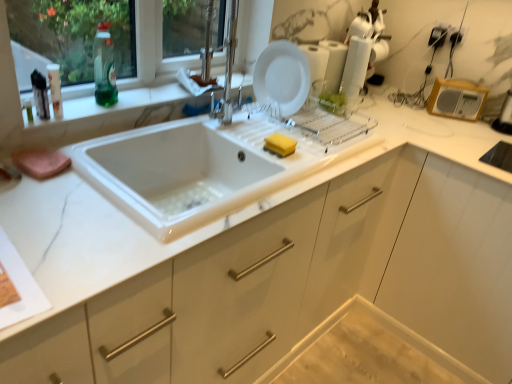
I want to click on translucent plastic bottle at upper left, arranged as the second bottle when viewed from the right, so click(x=55, y=89).

In order to face white glossy plate at upper center, which is the second appliance from right to left, should I rotate leftwards or rightwards?

To face it directly, rotate right by 8.018 degrees.

What do you see at coordinates (104, 67) in the screenshot? The height and width of the screenshot is (384, 512). I see `green translucent bottle at upper left, the second bottle from the front` at bounding box center [104, 67].

This screenshot has height=384, width=512. Identify the location of wooden radio at upper right, placed as the 2th appliance when sorted from left to right. (456, 99).

What is the approximate height of marble-like white at left?

marble-like white at left is 2.30 centimeters in height.

Find the location of a particular element. The width and height of the screenshot is (512, 384). white matte plate at upper center is located at coordinates (282, 78).

Is white glossy plate at upper center, the first appliance positioned from the left, not close to white matte plate at upper center?

No, white glossy plate at upper center, the first appliance positioned from the left, is in close proximity to white matte plate at upper center.

Between white glossy plate at upper center, which is the second appliance from right to left, and white matte plate at upper center, which one is positioned in front?

white matte plate at upper center.

Can we say white glossy plate at upper center, the first appliance positioned from the left, lies outside white matte plate at upper center?

Yes, white glossy plate at upper center, the first appliance positioned from the left, is outside of white matte plate at upper center.

From a real-world perspective, which is physically above, white glossy plate at upper center, which is the second appliance from right to left, or white matte plate at upper center?

white matte plate at upper center, from a real-world perspective.

Considering the positions of objects white matte plate at upper center and wooden radio at upper right, placed as the 2th appliance when sorted from left to right, in the image provided, who is more to the left, white matte plate at upper center or wooden radio at upper right, placed as the 2th appliance when sorted from left to right,?

white matte plate at upper center.

Is the position of white matte plate at upper center more distant than that of wooden radio at upper right, placed as the 2th appliance when sorted from left to right?

No, it is in front of wooden radio at upper right, placed as the 2th appliance when sorted from left to right.

Consider the image. Considering the sizes of objects white matte plate at upper center and wooden radio at upper right, marked as the first appliance in a right-to-left arrangement, in the image provided, who is wider, white matte plate at upper center or wooden radio at upper right, marked as the first appliance in a right-to-left arrangement,?

wooden radio at upper right, marked as the first appliance in a right-to-left arrangement.

Consider the image. From a real-world perspective, which object rests below the other?

wooden radio at upper right, marked as the first appliance in a right-to-left arrangement, from a real-world perspective.

Is translucent plastic bottle at upper left, which is the 1th bottle in front-to-back order, to the right of white glossy plate at upper center, the first appliance positioned from the left, from the viewer's perspective?

In fact, translucent plastic bottle at upper left, which is the 1th bottle in front-to-back order, is to the left of white glossy plate at upper center, the first appliance positioned from the left.

How far apart are translucent plastic bottle at upper left, the first bottle from the left, and white glossy plate at upper center, which is the second appliance from right to left?

translucent plastic bottle at upper left, the first bottle from the left, and white glossy plate at upper center, which is the second appliance from right to left, are 1.07 meters apart from each other.

From the image's perspective, which one is positioned lower, translucent plastic bottle at upper left, which is the 1th bottle in front-to-back order, or white glossy plate at upper center, which is the second appliance from right to left?

translucent plastic bottle at upper left, which is the 1th bottle in front-to-back order, is shown below in the image.

Considering the relative sizes of translucent plastic bottle at upper left, which is the 1th bottle in front-to-back order, and white glossy plate at upper center, which is the second appliance from right to left, in the image provided, is translucent plastic bottle at upper left, which is the 1th bottle in front-to-back order, wider than white glossy plate at upper center, which is the second appliance from right to left,?

No, translucent plastic bottle at upper left, which is the 1th bottle in front-to-back order, is not wider than white glossy plate at upper center, which is the second appliance from right to left.

Is translucent plastic bottle at upper left, the first bottle from the left, far away from white glossy sink at center?

They are positioned close to each other.

Which of these two, translucent plastic bottle at upper left, which is the 1th bottle in front-to-back order, or white glossy sink at center, stands taller?

white glossy sink at center.

Is point (60, 118) in front of point (208, 189)?

Yes, it is in front of point (208, 189).

Which of these two, yellow sponge at sink or green translucent bottle at upper left, which is the second bottle in left-to-right order, is bigger?

green translucent bottle at upper left, which is the second bottle in left-to-right order.

Is yellow sponge at sink beside green translucent bottle at upper left, which is the second bottle in left-to-right order?

No, yellow sponge at sink is not in contact with green translucent bottle at upper left, which is the second bottle in left-to-right order.

Looking at this image, which object is closer to the camera taking this photo, yellow sponge at sink or green translucent bottle at upper left, placed as the first bottle when sorted from right to left?

green translucent bottle at upper left, placed as the first bottle when sorted from right to left, is more forward.

Can you tell me how much yellow sponge at sink and green translucent bottle at upper left, the second bottle from the front, differ in facing direction?

They differ by 8.34 degrees in their facing directions.

From the image's perspective, does yellow sponge at sink appear lower than translucent plastic bottle at upper left, which is the 1th bottle in front-to-back order?

Correct, yellow sponge at sink appears lower than translucent plastic bottle at upper left, which is the 1th bottle in front-to-back order, in the image.

Is yellow sponge at sink placed right next to translucent plastic bottle at upper left, the 2th bottle viewed from the back?

yellow sponge at sink is not next to translucent plastic bottle at upper left, the 2th bottle viewed from the back, and they're not touching.

Is yellow sponge at sink oriented away from translucent plastic bottle at upper left, which is the 1th bottle in front-to-back order?

No, translucent plastic bottle at upper left, which is the 1th bottle in front-to-back order, is not at the back of yellow sponge at sink.

From a real-world perspective, which object rests below the other?

In real-world perspective, yellow sponge at sink is lower.

Between marble-like white at left and wooden radio at upper right, marked as the first appliance in a right-to-left arrangement, which one has smaller width?

wooden radio at upper right, marked as the first appliance in a right-to-left arrangement.

Is marble-like white at left positioned far away from wooden radio at upper right, placed as the 2th appliance when sorted from left to right?

Indeed, marble-like white at left is not near wooden radio at upper right, placed as the 2th appliance when sorted from left to right.

Is marble-like white at left facing away from wooden radio at upper right, marked as the first appliance in a right-to-left arrangement?

marble-like white at left does not have its back to wooden radio at upper right, marked as the first appliance in a right-to-left arrangement.

How different are the orientations of marble-like white at left and wooden radio at upper right, marked as the first appliance in a right-to-left arrangement, in degrees?

57.7 degrees.

The height and width of the screenshot is (384, 512). Find the location of `plate above the white glossy plate at upper center, which is the second appliance from right to left (from a real-world perspective)`. plate above the white glossy plate at upper center, which is the second appliance from right to left (from a real-world perspective) is located at coordinates (282, 78).

Identify the location of appliance located below the white matte plate at upper center (from the image's perspective). (456, 99).

Looking at the image, which one is located further to white matte plate at upper center, translucent plastic bottle at upper left, the first bottle from the left, or wooden radio at upper right, marked as the first appliance in a right-to-left arrangement?

Based on the image, wooden radio at upper right, marked as the first appliance in a right-to-left arrangement, appears to be further to white matte plate at upper center.

When comparing their distances from white glossy plate at upper center, which is the second appliance from right to left, does wooden radio at upper right, placed as the 2th appliance when sorted from left to right, or white matte plate at upper center seem further?

wooden radio at upper right, placed as the 2th appliance when sorted from left to right, is further to white glossy plate at upper center, which is the second appliance from right to left.

From the image, which object appears to be nearer to white glossy sink at center, yellow sponge at sink or green translucent bottle at upper left, the second bottle from the front?

yellow sponge at sink is positioned closer to the anchor white glossy sink at center.

From the image, which object appears to be farther from white glossy plate at upper center, which is the second appliance from right to left, translucent plastic bottle at upper left, which is the 1th bottle in front-to-back order, or wooden radio at upper right, placed as the 2th appliance when sorted from left to right?

Based on the image, translucent plastic bottle at upper left, which is the 1th bottle in front-to-back order, appears to be further to white glossy plate at upper center, which is the second appliance from right to left.

Estimate the real-world distances between objects in this image. Which object is further from marble-like white at left, translucent plastic bottle at upper left, arranged as the second bottle when viewed from the right, or white glossy sink at center?

white glossy sink at center is further to marble-like white at left.

From the image, which object appears to be nearer to white glossy plate at upper center, the first appliance positioned from the left, translucent plastic bottle at upper left, arranged as the second bottle when viewed from the right, or white glossy sink at center?

white glossy sink at center.

Estimate the real-world distances between objects in this image. Which object is closer to white glossy sink at center, white glossy plate at upper center, which is the second appliance from right to left, or translucent plastic bottle at upper left, the 2th bottle viewed from the back?

Among the two, translucent plastic bottle at upper left, the 2th bottle viewed from the back, is located nearer to white glossy sink at center.

Estimate the real-world distances between objects in this image. Which object is further from white glossy plate at upper center, which is the second appliance from right to left, white glossy sink at center or translucent plastic bottle at upper left, which is the 1th bottle in front-to-back order?

translucent plastic bottle at upper left, which is the 1th bottle in front-to-back order, is further to white glossy plate at upper center, which is the second appliance from right to left.

What are the coordinates of `bottle between translucent plastic bottle at upper left, which is the 1th bottle in front-to-back order, and wooden radio at upper right, marked as the first appliance in a right-to-left arrangement` in the screenshot? It's located at (104, 67).

Find the location of `window sill located between white glossy sink at center and white glossy plate at upper center, which is the second appliance from right to left, in the depth direction`. window sill located between white glossy sink at center and white glossy plate at upper center, which is the second appliance from right to left, in the depth direction is located at coordinates (119, 104).

The height and width of the screenshot is (384, 512). In order to click on window sill between green translucent bottle at upper left, which is the second bottle in left-to-right order, and white matte plate at upper center from left to right in this screenshot , I will do `click(119, 104)`.

This screenshot has height=384, width=512. Find the location of `plate between yellow sponge at sink and white glossy plate at upper center, the first appliance positioned from the left, along the z-axis`. plate between yellow sponge at sink and white glossy plate at upper center, the first appliance positioned from the left, along the z-axis is located at coordinates (282, 78).